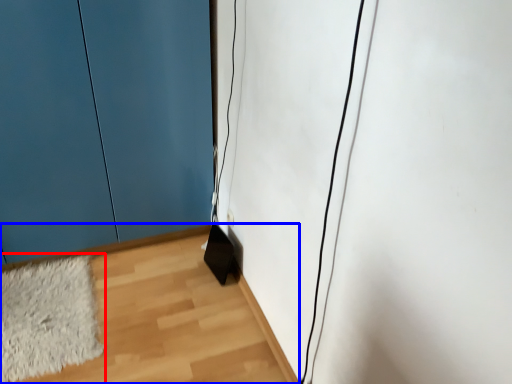
Question: Which object is further to the camera taking this photo, mat (highlighted by a red box) or corridor (highlighted by a blue box)?

Choices:
 (A) mat
 (B) corridor

Answer: (A)